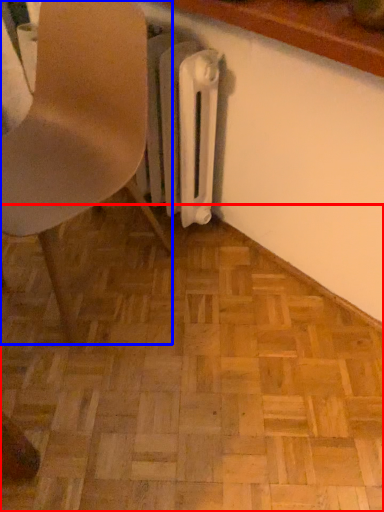
Question: Among these objects, which one is nearest to the camera, plywood (highlighted by a red box) or chair (highlighted by a blue box)?

Choices:
 (A) plywood
 (B) chair

Answer: (B)